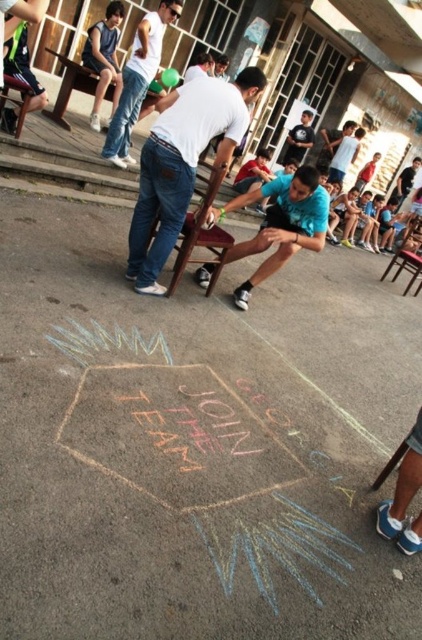
You are a photographer positioned at the back of the courtyard. You want to capture a photo of the brown wooden chair at center and the wooden chair at right without any obstruction. Based on their positions, which chair should you focus on first to ensure it appears in the foreground of the photo?

The brown wooden chair at center should be focused on first because it is positioned below the wooden chair at right, meaning it is closer to the photographer and will naturally appear in the foreground of the photo.

You are standing at the point marked as point (195, 225) and want to throw a ball to your friend who is at the other end of the courtyard. The courtyard is 4.00 meters wide. Can you throw the ball across the courtyard to reach your friend?

The distance between you and your friend at point (195, 225) is 4.00 meters. If the courtyard is 4.00 meters wide, then yes, you can throw the ball across the courtyard to reach your friend.

You are standing in the courtyard and want to move from the brown wooden chair at center to the wooden chair at left. Which direction should you move in?

Since the brown wooden chair at center is closer to the viewer than the wooden chair at left, you should move backward to reach the wooden chair at left.